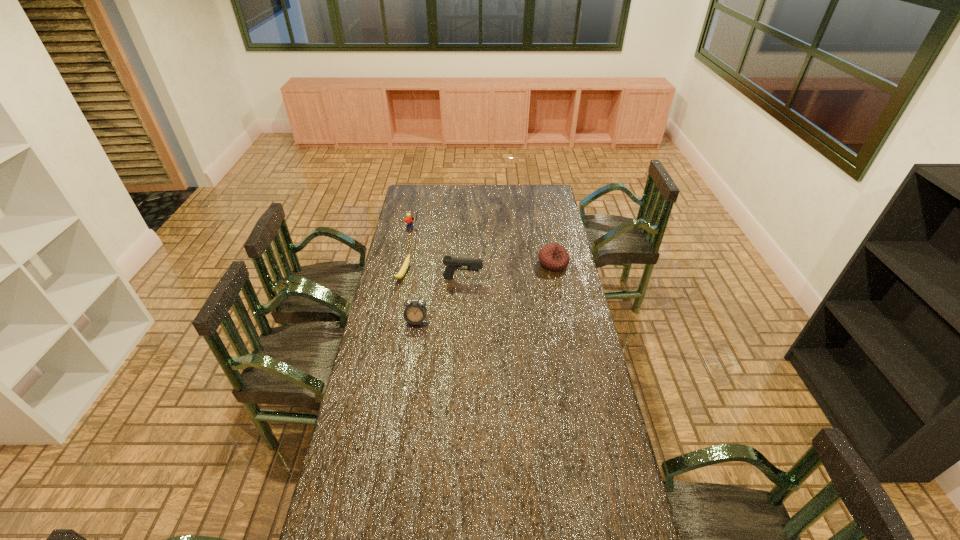
Find the location of `free spot on the desktop that is between the third object from left to right and the second shortest object and is positioned on the upward curve of the shortest object`. free spot on the desktop that is between the third object from left to right and the second shortest object and is positioned on the upward curve of the shortest object is located at coordinates (492, 289).

At what (x,y) coordinates should I click in order to perform the action: click on free space on the desktop that is between the third object from left to right and the rightmost object and is positioned on the front-facing side of the Lego. Please return your answer as a coordinate pair (x, y). This screenshot has height=540, width=960. Looking at the image, I should click on (490, 290).

Identify the location of vacant space on the desktop that is between the nearest object and the rightmost object and is positioned at the barrel of the pistol. This screenshot has width=960, height=540. (509, 282).